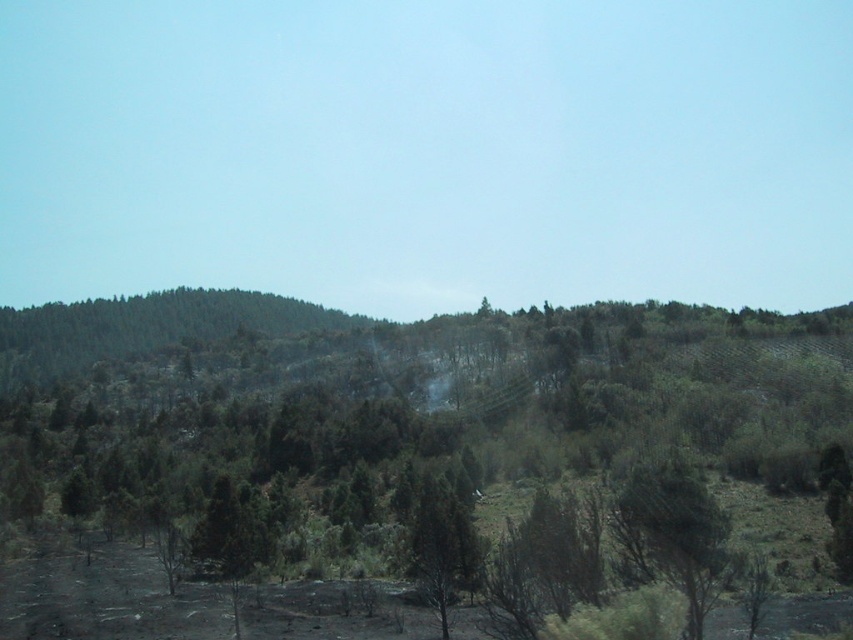
You are standing at the point marked by the coordinates point (x=666, y=474) in the forest. You want to walk to the nearest hill covered with greenery. Which direction should you walk to reach it?

The nearest hill covered with greenery is located in the background, which is behind the point (x=666, y=474). Therefore, you should walk in the direction away from the foreground towards the background to reach it.

You are a hiker who wants to take a photo of both the green leafy tree at center and the green textured tree at center. Which tree should you stand closer to in order to capture both in the same frame?

The green textured tree at center is shorter than the green leafy tree at center, so you should stand closer to the green textured tree at center to ensure both are visible in the photo frame.